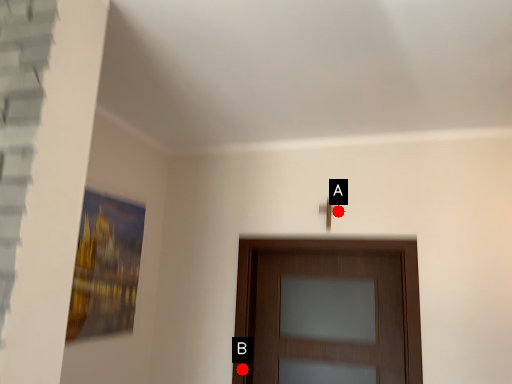
Question: Two points are circled on the image, labeled by A and B beside each circle. Which point is farther from the camera taking this photo?

Choices:
 (A) A is further
 (B) B is further

Answer: (B)